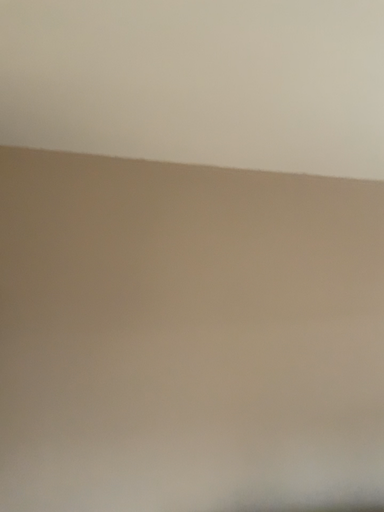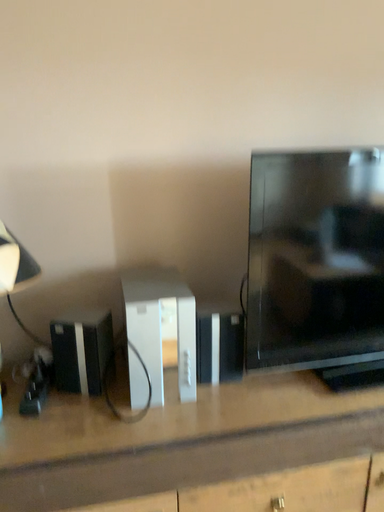
Question: Which way did the camera rotate in the video?

Choices:
 (A) rotated downward
 (B) rotated upward

Answer: (A)